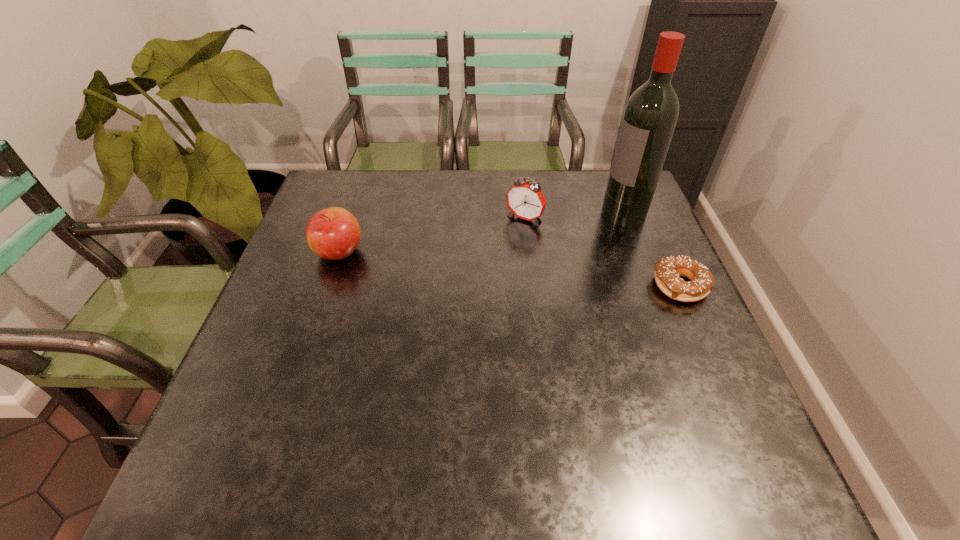
Where is `vacant space on the desktop that is between the leftmost object and the shortest object and is positioned on the label of the tallest object`? The height and width of the screenshot is (540, 960). vacant space on the desktop that is between the leftmost object and the shortest object and is positioned on the label of the tallest object is located at coordinates click(492, 267).

This screenshot has height=540, width=960. I want to click on vacant spot on the desktop that is between the leftmost object and the doughnut and is positioned on the clock face of the second object from left to right, so click(488, 267).